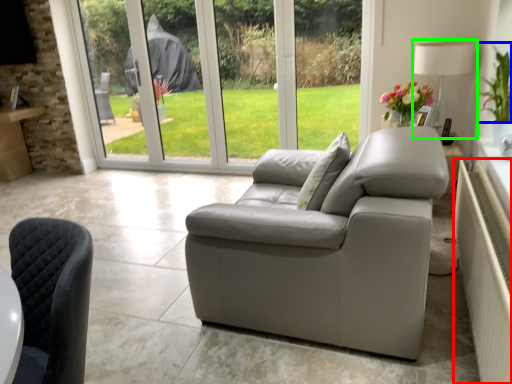
Question: Which object is the farthest from radiator (highlighted by a red box)? Choose among these: plant (highlighted by a blue box) or lamp (highlighted by a green box).

Choices:
 (A) plant
 (B) lamp

Answer: (B)